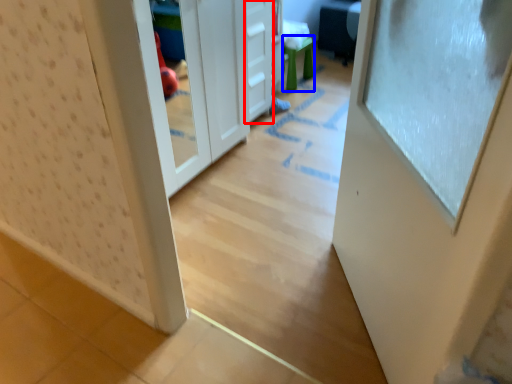
Question: Which object appears closest to the camera in this image, drawer (highlighted by a red box) or stool (highlighted by a blue box)?

Choices:
 (A) drawer
 (B) stool

Answer: (A)